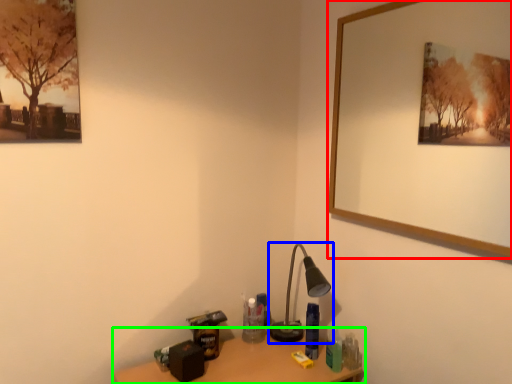
Question: Which object is the closest to the picture frame (highlighted by a red box)? Choose among these: lamp (highlighted by a blue box) or table (highlighted by a green box).

Choices:
 (A) lamp
 (B) table

Answer: (A)